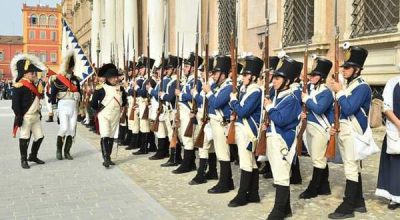
The width and height of the screenshot is (400, 220). I want to click on window top right corner, so click(369, 26).